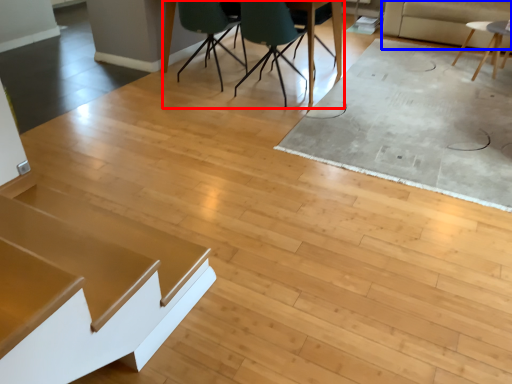
Question: Which object is further to the camera taking this photo, table (highlighted by a red box) or couch (highlighted by a blue box)?

Choices:
 (A) table
 (B) couch

Answer: (B)